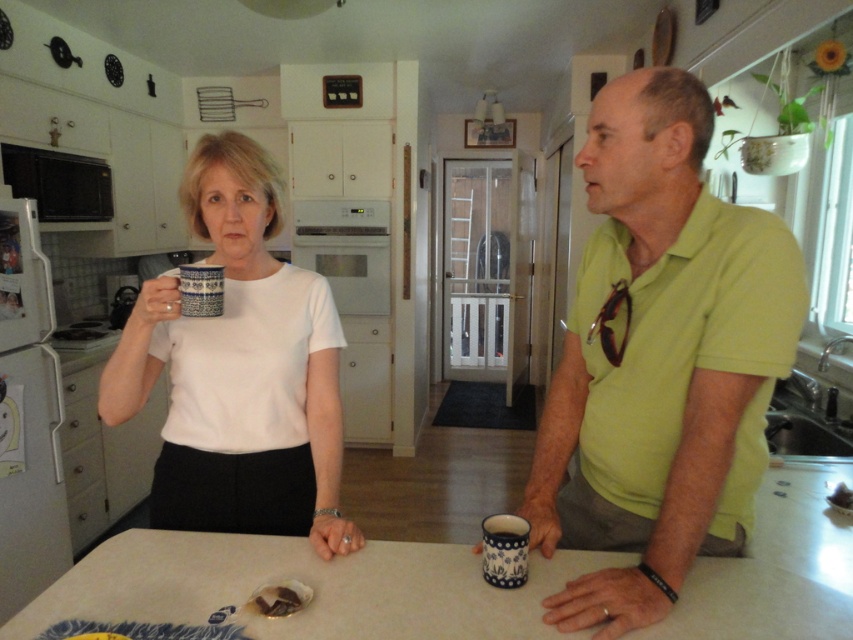
Question: Is white laminate table at center bigger than blue ceramic mug at upper center?

Choices:
 (A) yes
 (B) no

Answer: (A)

Question: Is white laminate table at center further to the viewer compared to blue ceramic mug at upper center?

Choices:
 (A) no
 (B) yes

Answer: (A)

Question: Which point is farther from the camera taking this photo?

Choices:
 (A) (247, 144)
 (B) (201, 284)
 (C) (669, 236)

Answer: (A)

Question: Among these points, which one is farthest from the camera?

Choices:
 (A) (207, 179)
 (B) (206, 285)

Answer: (A)

Question: Does white laminate table at center come in front of blue ceramic mug at lower right?

Choices:
 (A) no
 (B) yes

Answer: (B)

Question: Considering the real-world distances, which object is closest to the white laminate table at center?

Choices:
 (A) blue ceramic mug at left
 (B) green matte shirt at right
 (C) blue ceramic mug at upper center
 (D) blue ceramic mug at lower right

Answer: (D)